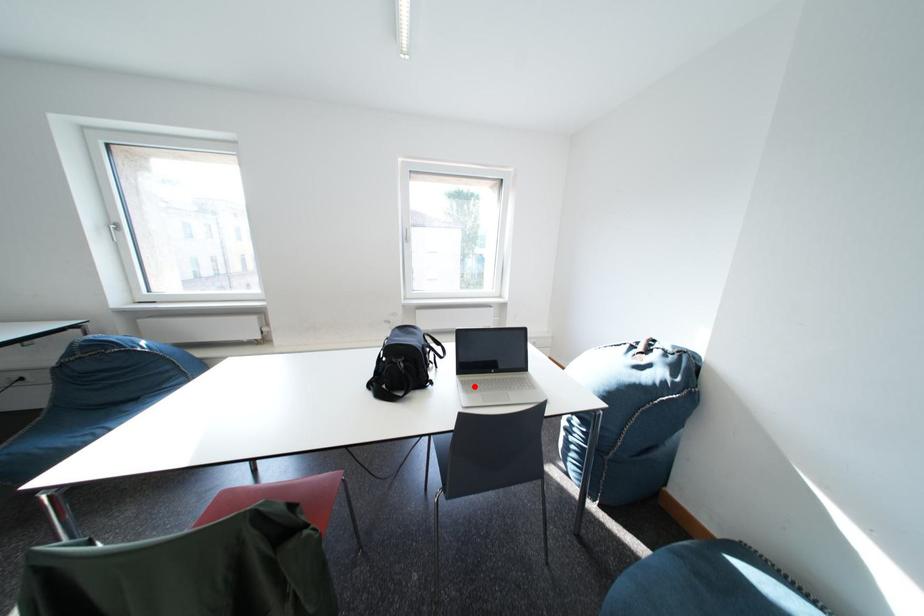
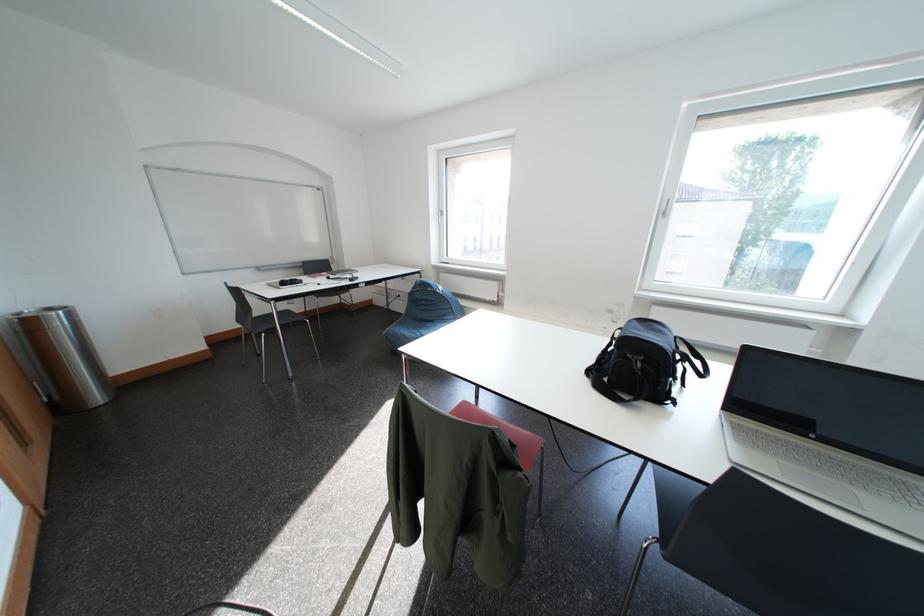
In the second image, find the point that corresponds to the highlighted location in the first image.

(747, 431)